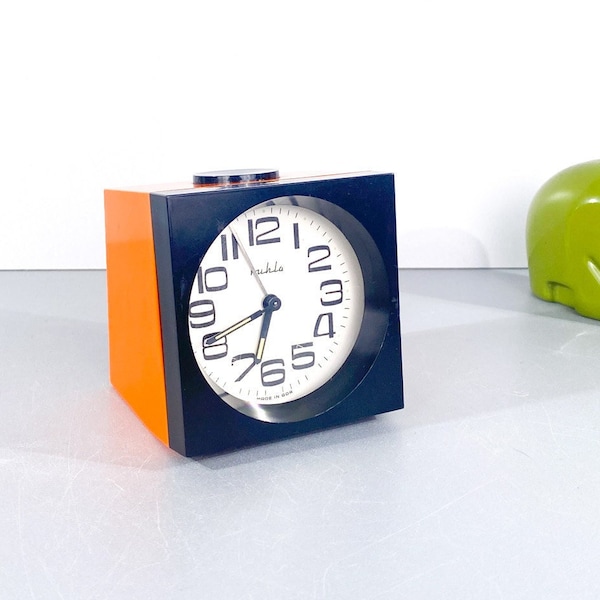
You are a GUI agent. You are given a task and a screenshot of the screen. Output one action in this format:
    pyautogui.click(x=<x>, y=<y>)
    Task: Click on the wall
    
    Given the screenshot: What is the action you would take?
    pyautogui.click(x=438, y=142)